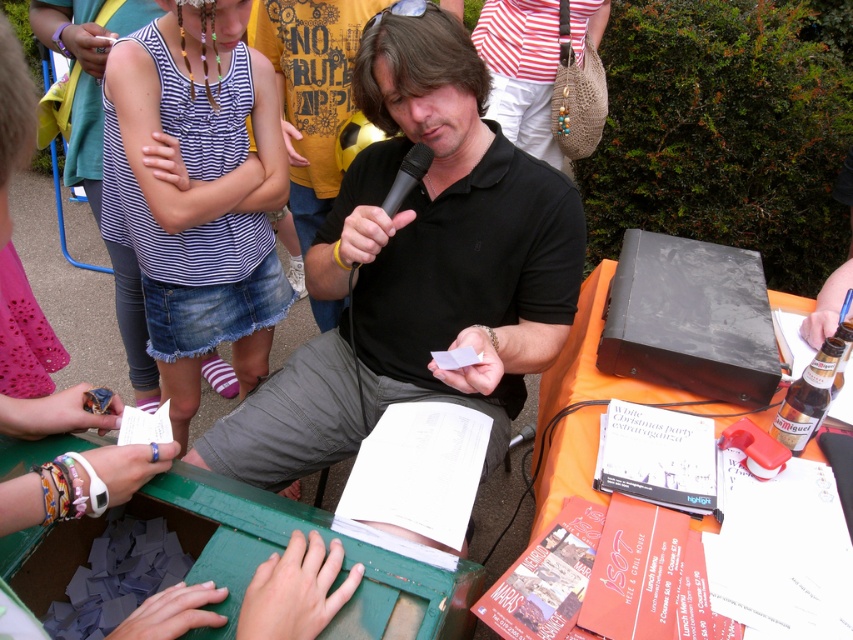
Measure the distance between black matte shirt at center and brown glass bottle at lower right.

A distance of 27.65 inches exists between black matte shirt at center and brown glass bottle at lower right.

Is point (329, 228) farther from viewer compared to point (804, 406)?

Yes, it is behind point (804, 406).

Is point (392, 221) closer to viewer compared to point (825, 348)?

No, (392, 221) is behind (825, 348).

Where is `black matte shirt at center`? The image size is (853, 640). black matte shirt at center is located at coordinates (416, 268).

Is point (722, 416) positioned before point (825, 371)?

No, (722, 416) is further to viewer.

Can you confirm if orange fabric table at right is wider than brown glass bottle at lower right?

Correct, the width of orange fabric table at right exceeds that of brown glass bottle at lower right.

Image resolution: width=853 pixels, height=640 pixels. In order to click on orange fabric table at right in this screenshot , I will do `click(590, 406)`.

Does black matte shirt at center appear over black matte microphone at center?

Actually, black matte shirt at center is below black matte microphone at center.

Is point (320, 356) positioned behind point (399, 179)?

That is True.

Locate an element on the screen. black matte shirt at center is located at coordinates (416, 268).